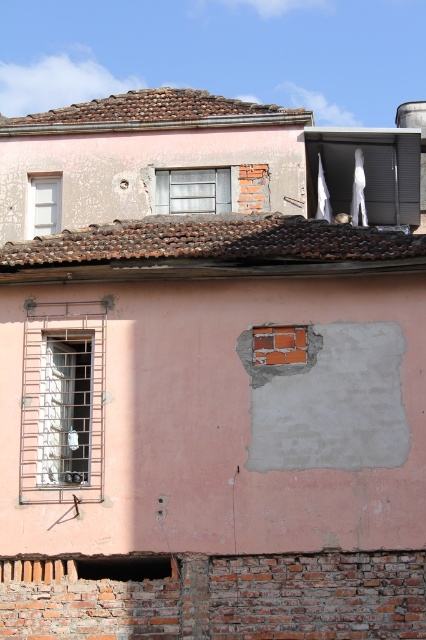
Question: Which object appears farthest from the camera in this image?

Choices:
 (A) metallic gray window at center
 (B) white fabric at upper center
 (C) white matte window at upper left
 (D) metallic wire mesh window at left

Answer: (C)

Question: Is metallic wire mesh window at left above white fabric at upper center?

Choices:
 (A) yes
 (B) no

Answer: (B)

Question: Where is metallic gray window at center located in relation to white matte window at upper left in the image?

Choices:
 (A) right
 (B) left

Answer: (A)

Question: Among these points, which one is farthest from the camera?

Choices:
 (A) click(x=226, y=198)
 (B) click(x=36, y=196)
 (C) click(x=391, y=132)

Answer: (B)

Question: Among these points, which one is nearest to the camera?

Choices:
 (A) (198, 198)
 (B) (359, 172)
 (C) (69, 465)
 (D) (34, 218)

Answer: (C)

Question: Is metallic wire mesh window at left smaller than white fabric at upper center?

Choices:
 (A) yes
 (B) no

Answer: (B)